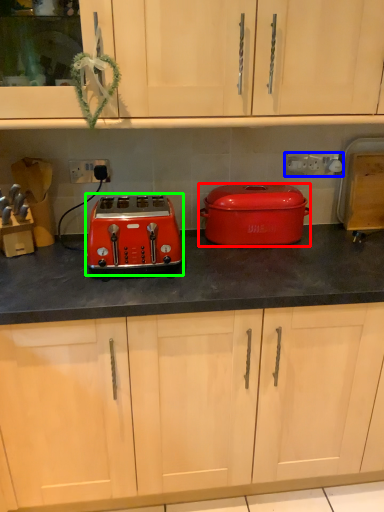
Question: Which is farther away from kitchen appliance (highlighted by a red box)? electric outlet (highlighted by a blue box) or toaster (highlighted by a green box)?

Choices:
 (A) electric outlet
 (B) toaster

Answer: (B)